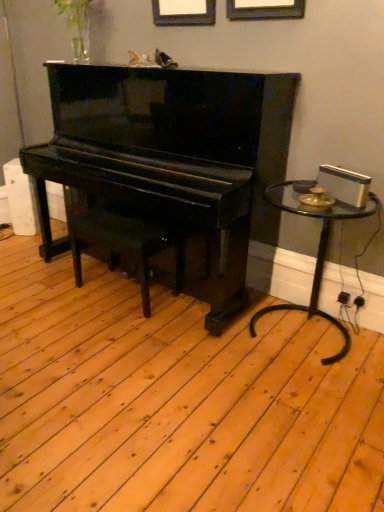
What are the coordinates of `transparent glass table at right` in the screenshot? It's located at (317, 261).

What is the approximate width of black polished wood music stool at center?

black polished wood music stool at center is 34.04 centimeters in width.

You are a GUI agent. You are given a task and a screenshot of the screen. Output one action in this format:
    pyautogui.click(x=<x>, y=<y>)
    Task: Click on the glossy black piano at center
    The height and width of the screenshot is (512, 384).
    Given the screenshot: What is the action you would take?
    pyautogui.click(x=166, y=170)

Looking at this image, between transparent glass table at right and black polished wood music stool at center, which one appears on the left side from the viewer's perspective?

Positioned to the left is black polished wood music stool at center.

Would you say transparent glass table at right contains black polished wood music stool at center?

No, black polished wood music stool at center is not surrounded by transparent glass table at right.

Identify the location of table that appears in front of the black polished wood music stool at center. (317, 261).

From a real-world perspective, is glossy black piano at center below black polished wood music stool at center?

Incorrect, from a real-world perspective, glossy black piano at center is higher than black polished wood music stool at center.

Considering the relative sizes of glossy black piano at center and black polished wood music stool at center in the image provided, is glossy black piano at center taller than black polished wood music stool at center?

Yes, glossy black piano at center is taller than black polished wood music stool at center.

Are glossy black piano at center and black polished wood music stool at center located far from each other?

No, there isn't a large distance between glossy black piano at center and black polished wood music stool at center.

Could you tell me if glossy black piano at center is turned towards black polished wood music stool at center?

Yes, glossy black piano at center is turned towards black polished wood music stool at center.

Between point (41, 224) and point (344, 339), which one is positioned behind?

The point (41, 224) is farther.

Consider the image. Is glossy black piano at center bigger than transparent glass table at right?

Correct, glossy black piano at center is larger in size than transparent glass table at right.

Is transparent glass table at right inside glossy black piano at center?

No.

Considering the relative positions of glossy black piano at center and transparent glass table at right in the image provided, is glossy black piano at center to the right of transparent glass table at right from the viewer's perspective?

No.

Is black polished wood music stool at center at the left side of glossy black piano at center?

Yes.

Would you consider black polished wood music stool at center to be distant from glossy black piano at center?

Actually, black polished wood music stool at center and glossy black piano at center are a little close together.

Is black polished wood music stool at center in front of or behind glossy black piano at center in the image?

Clearly, black polished wood music stool at center is behind glossy black piano at center.

The image size is (384, 512). I want to click on music stool located behind the glossy black piano at center, so click(x=121, y=239).

Can you tell me how much black polished wood music stool at center and transparent glass table at right differ in facing direction?

There is a 1.16-degree angle between the facing directions of black polished wood music stool at center and transparent glass table at right.

The width and height of the screenshot is (384, 512). In order to click on music stool located underneath the transparent glass table at right (from a real-world perspective) in this screenshot , I will do `click(121, 239)`.

Which is more to the left, black polished wood music stool at center or transparent glass table at right?

Positioned to the left is black polished wood music stool at center.

Does black polished wood music stool at center have a lesser height compared to transparent glass table at right?

Yes.

Which is more to the right, transparent glass table at right or glossy black piano at center?

Positioned to the right is transparent glass table at right.

From the image's perspective, is transparent glass table at right beneath glossy black piano at center?

Yes.

The image size is (384, 512). What are the coordinates of `piano above the transparent glass table at right (from a real-world perspective)` in the screenshot? It's located at point(166,170).

Considering the sizes of transparent glass table at right and glossy black piano at center in the image, is transparent glass table at right taller or shorter than glossy black piano at center?

Clearly, transparent glass table at right is shorter compared to glossy black piano at center.

Where is `table that appears above the black polished wood music stool at center (from a real-world perspective)`? This screenshot has width=384, height=512. table that appears above the black polished wood music stool at center (from a real-world perspective) is located at coordinates (317, 261).

In order to click on piano in front of the black polished wood music stool at center in this screenshot , I will do `click(166, 170)`.

Looking at the image, which one is located further to glossy black piano at center, black polished wood music stool at center or transparent glass table at right?

Based on the image, transparent glass table at right appears to be further to glossy black piano at center.

When comparing their distances from transparent glass table at right, does glossy black piano at center or black polished wood music stool at center seem further?

Among the two, black polished wood music stool at center is located further to transparent glass table at right.

Which object lies further to the anchor point glossy black piano at center, transparent glass table at right or black polished wood music stool at center?

transparent glass table at right is positioned further to the anchor glossy black piano at center.

In the scene shown: Considering their positions, is glossy black piano at center positioned closer to black polished wood music stool at center than transparent glass table at right?

glossy black piano at center is closer to black polished wood music stool at center.

Looking at the image, which one is located further to black polished wood music stool at center, transparent glass table at right or glossy black piano at center?

transparent glass table at right is further to black polished wood music stool at center.

When comparing their distances from transparent glass table at right, does black polished wood music stool at center or glossy black piano at center seem closer?

Based on the image, glossy black piano at center appears to be nearer to transparent glass table at right.

Find the location of a particular element. The width and height of the screenshot is (384, 512). piano located between black polished wood music stool at center and transparent glass table at right in the left-right direction is located at coordinates (166, 170).